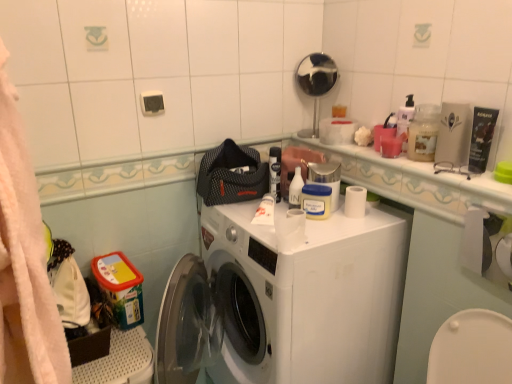
Question: From the image's perspective, is yellow matte jar at center, which is counted as the 4th toiletry, starting from the right, above or below translucent plastic container at upper right?

Choices:
 (A) below
 (B) above

Answer: (A)

Question: Does point (303, 200) appear closer or farther from the camera than point (416, 155)?

Choices:
 (A) farther
 (B) closer

Answer: (A)

Question: Which of these objects is positioned farthest from the polished chrome mirror at upper center?

Choices:
 (A) matte black tube at upper right, placed as the fifth toiletry when sorted from left to right
 (B) translucent plastic container at upper right
 (C) white plastic bottle at upper center, which ranks as the first toiletry in left-to-right order
 (D) yellow matte jar at center, which is counted as the 4th toiletry, starting from the right
 (E) white glossy counter top at upper right

Answer: (A)

Question: Considering the real-world distances, which object is farthest from the matte black tube at upper right, marked as the first toiletry in a right-to-left arrangement?

Choices:
 (A) polished chrome mirror at upper center
 (B) translucent plastic cup at upper right, which is the third toiletry from right to left
 (C) white plastic bottle at upper center, arranged as the 5th toiletry when viewed from the right
 (D) white plastic washing machine at center
 (E) pink matte candle at upper right, the second toiletry when ordered from right to left

Answer: (D)